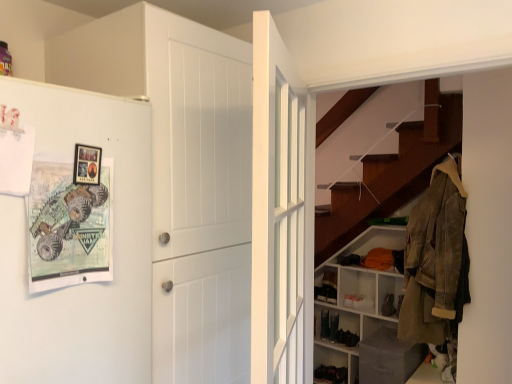
Question: Is matte black shoe at lower center, which is the first shoe from left to right, not close to gray fabric box at lower right, the second shelf in the back-to-front sequence?

Choices:
 (A) no
 (B) yes

Answer: (A)

Question: Is matte black shoe at lower center, which is the first shoe from left to right, bigger than gray fabric box at lower right, the second shelf in the back-to-front sequence?

Choices:
 (A) yes
 (B) no

Answer: (B)

Question: Does matte black shoe at lower center, which ranks as the third shoe in front-to-back order, have a smaller size compared to gray fabric box at lower right, the first shelf when ordered from front to back?

Choices:
 (A) no
 (B) yes

Answer: (B)

Question: Is matte black shoe at lower center, which ranks as the third shoe in front-to-back order, to the right of gray fabric box at lower right, the first shelf when ordered from front to back, from the viewer's perspective?

Choices:
 (A) yes
 (B) no

Answer: (B)

Question: Considering the relative sizes of matte black shoe at lower center, which is the first shoe from left to right, and gray fabric box at lower right, the first shelf when ordered from front to back, in the image provided, is matte black shoe at lower center, which is the first shoe from left to right, taller than gray fabric box at lower right, the first shelf when ordered from front to back,?

Choices:
 (A) yes
 (B) no

Answer: (B)

Question: From the image's perspective, relative to white matte refrigerator at left, is leather jacket at right above or below?

Choices:
 (A) below
 (B) above

Answer: (A)

Question: Based on their sizes in the image, would you say leather jacket at right is bigger or smaller than white matte refrigerator at left?

Choices:
 (A) small
 (B) big

Answer: (A)

Question: Is leather jacket at right wider or thinner than white matte refrigerator at left?

Choices:
 (A) thin
 (B) wide

Answer: (A)

Question: From a real-world perspective, is leather jacket at right positioned above or below white matte refrigerator at left?

Choices:
 (A) below
 (B) above

Answer: (A)

Question: Is white matte shelving unit at lower right, positioned as the second shelf in front-to-back order, to the left or to the right of white matte door at center, placed as the second door when sorted from right to left, in the image?

Choices:
 (A) left
 (B) right

Answer: (B)

Question: From a real-world perspective, relative to white matte door at center, which is the 1th door from left to right, is white matte shelving unit at lower right, positioned as the second shelf in front-to-back order, vertically above or below?

Choices:
 (A) below
 (B) above

Answer: (A)

Question: In the image, is white matte shelving unit at lower right, the first shelf from the back, positioned in front of or behind white matte door at center, which is the 1th door from left to right?

Choices:
 (A) front
 (B) behind

Answer: (B)

Question: Considering the positions of white matte shelving unit at lower right, the first shelf from the back, and white matte door at center, which is the 1th door from left to right, in the image, is white matte shelving unit at lower right, the first shelf from the back, taller or shorter than white matte door at center, which is the 1th door from left to right,?

Choices:
 (A) short
 (B) tall

Answer: (A)

Question: Considering the relative positions of leather jacket at right and black suede shoe at lower center, which is the 3th shoe in left-to-right order, in the image provided, is leather jacket at right to the left or to the right of black suede shoe at lower center, which is the 3th shoe in left-to-right order,?

Choices:
 (A) right
 (B) left

Answer: (B)

Question: Considering the positions of leather jacket at right and black suede shoe at lower center, which is the 3th shoe in left-to-right order, in the image, is leather jacket at right taller or shorter than black suede shoe at lower center, which is the 3th shoe in left-to-right order,?

Choices:
 (A) tall
 (B) short

Answer: (A)